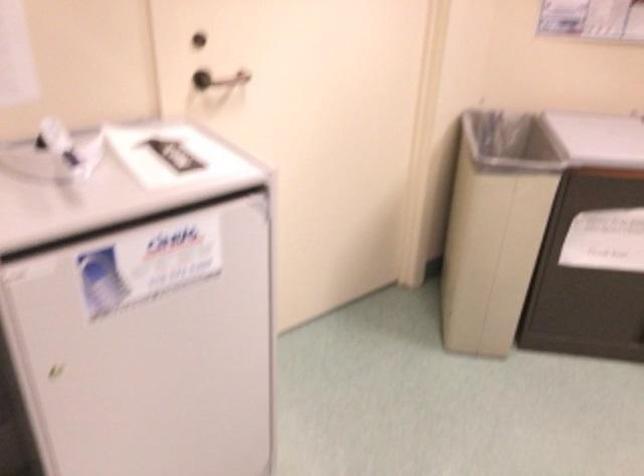
The height and width of the screenshot is (476, 644). In order to click on beige trash can in this screenshot , I will do `click(494, 227)`.